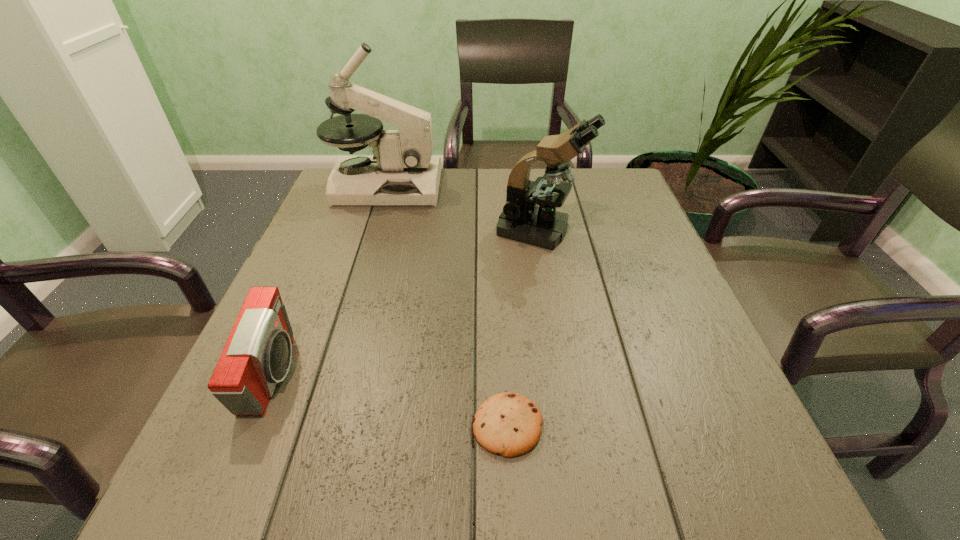
The image size is (960, 540). In order to click on object at the near edge in this screenshot , I will do 509,424.

Where is `microscope at the left edge`? This screenshot has width=960, height=540. microscope at the left edge is located at coordinates click(401, 172).

Where is `camera positioned at the left edge`? camera positioned at the left edge is located at coordinates (257, 355).

Locate an element on the screen. The height and width of the screenshot is (540, 960). object that is at the far left corner is located at coordinates 401,172.

Find the location of `free space at the far edge of the desktop`. free space at the far edge of the desktop is located at coordinates (477, 212).

You are a GUI agent. You are given a task and a screenshot of the screen. Output one action in this format:
    pyautogui.click(x=<x>, y=<y>)
    Task: Click on the free region at the near edge of the desktop
    This screenshot has height=540, width=960.
    Given the screenshot: What is the action you would take?
    pyautogui.click(x=403, y=484)

In order to click on free space at the left edge of the desktop in this screenshot , I will do `click(325, 218)`.

This screenshot has height=540, width=960. Identify the location of vacant space at the right edge of the desktop. (615, 306).

Where is `vacant space at the far left corner`? vacant space at the far left corner is located at coordinates (331, 213).

Where is `free space at the far right corner`? Image resolution: width=960 pixels, height=540 pixels. free space at the far right corner is located at coordinates (628, 200).